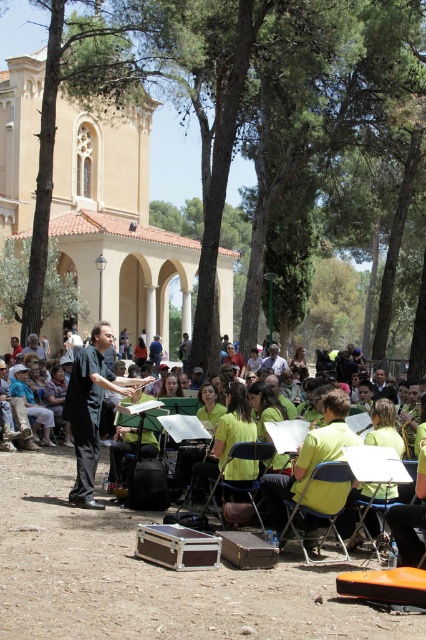
Consider the image. You are standing in the park and want to know how far the point marked at coordinates (334, 136) is from you. Can you determine the distance?

The point marked at coordinates (334, 136) is 74.35 meters away from the viewer.

You are a photographer trying to capture a photo of the black smooth conductor at center and the metallic silver chair at lower center. From your current position, which object is more to the left?

The black smooth conductor at center is positioned on the left side of metallic silver chair at lower center, so it is more to the left.